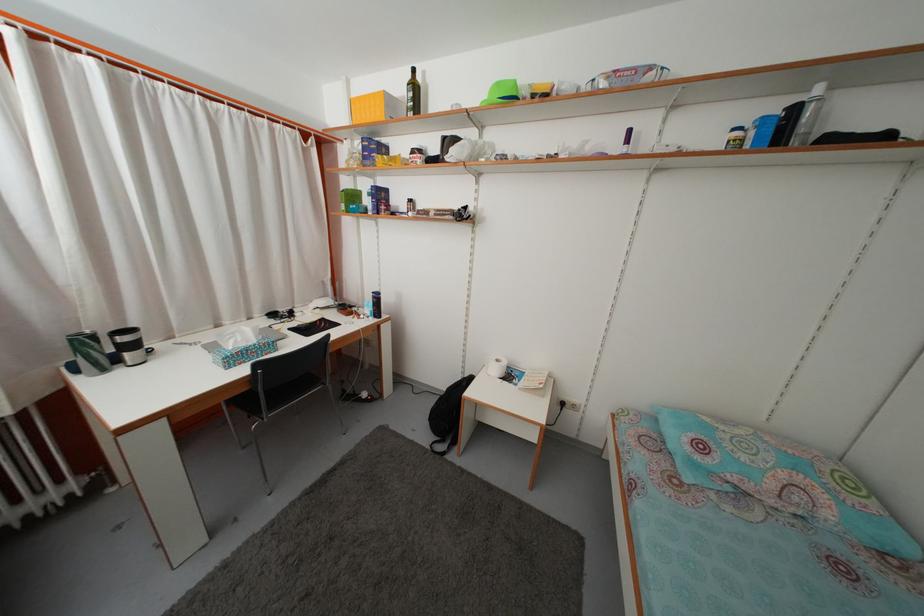
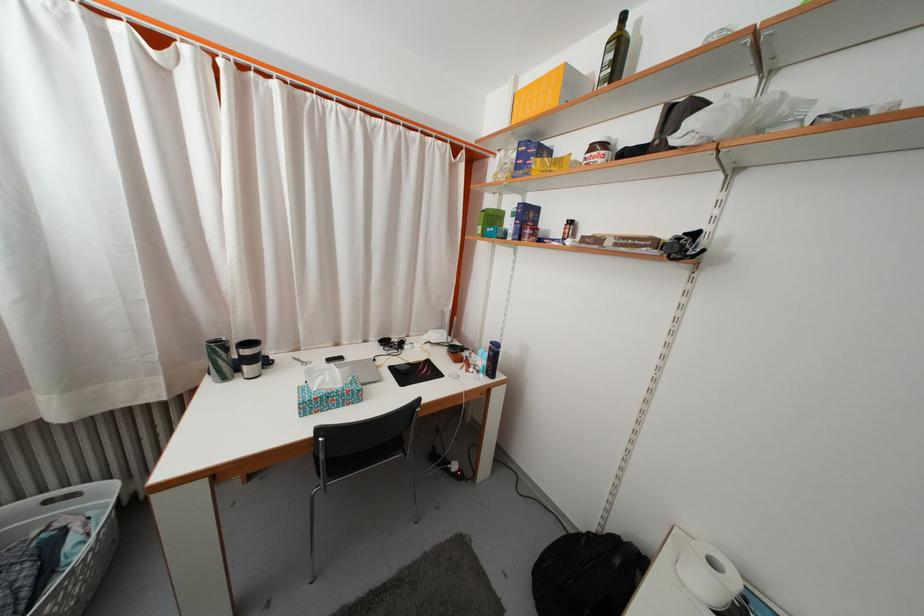
Locate, in the second image, the point that corresponds to point (233, 363) in the first image.

(310, 410)